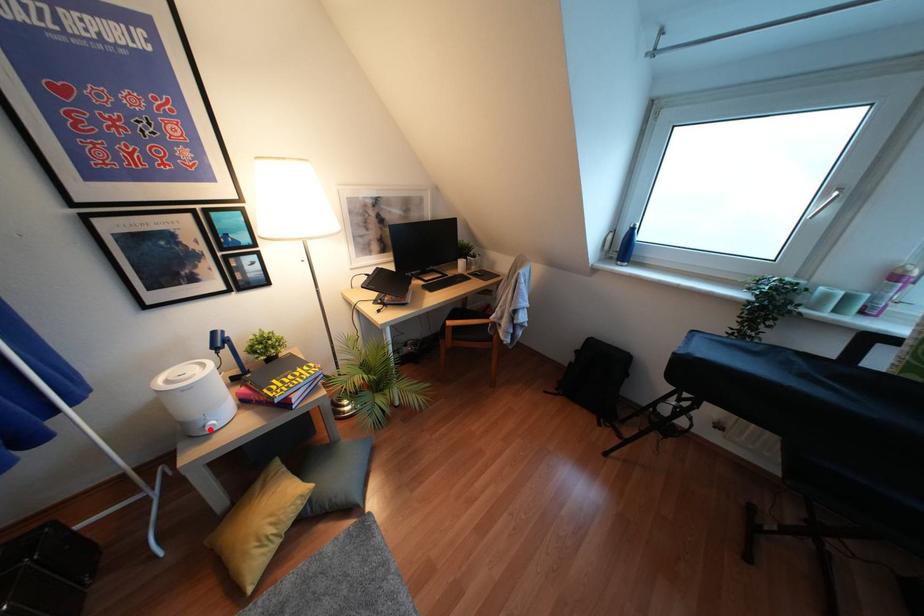
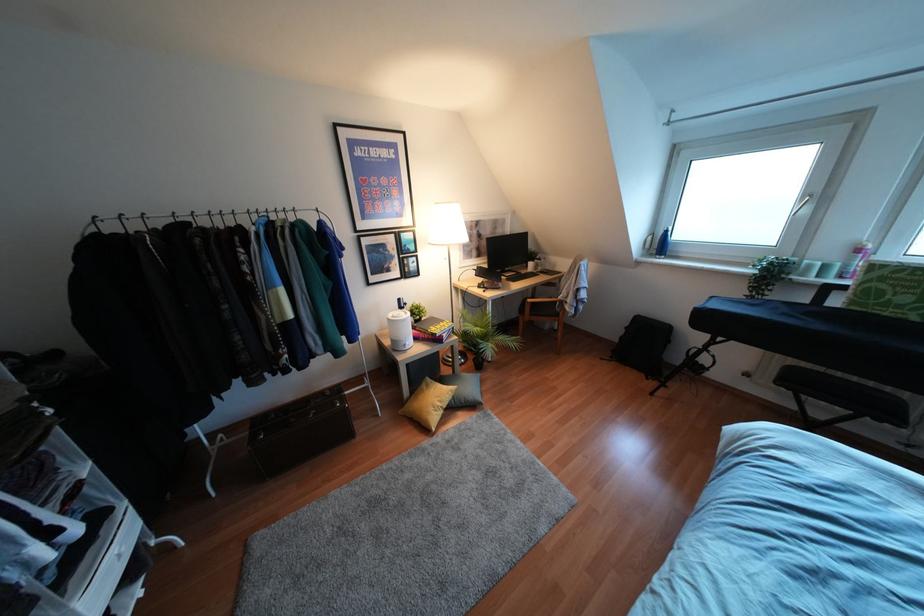
Question: I am providing you with two images of the same scene from different viewpoints. In image1, a red point is highlighted. Considering the same 3D point in image2, which of the following is correct?

Choices:
 (A) It is closer
 (B) It is farther

Answer: (B)